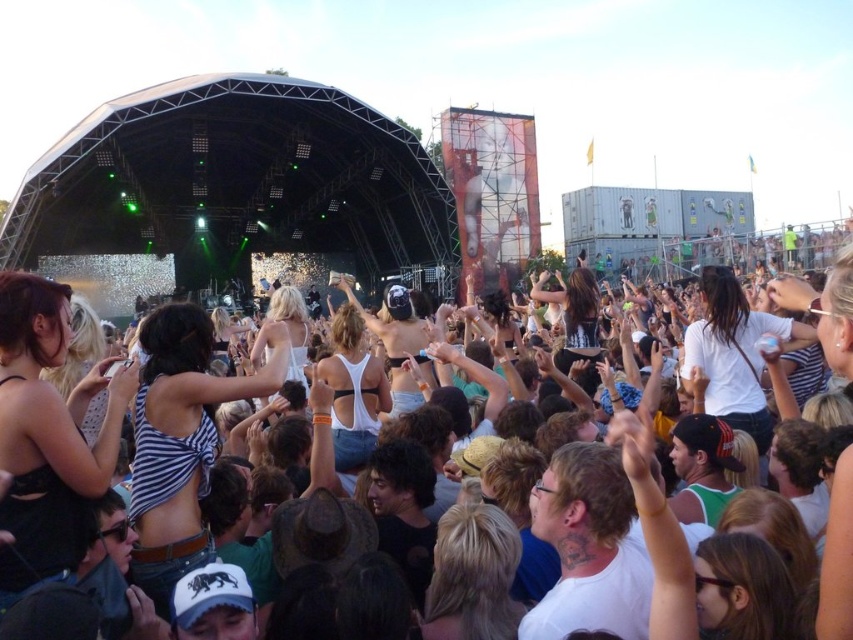
Question: Among these points, which one is nearest to the camera?

Choices:
 (A) (350, 422)
 (B) (821, 292)

Answer: (A)

Question: Does white fabric crowd at center have a smaller size compared to white matte bikini top at center?

Choices:
 (A) no
 (B) yes

Answer: (A)

Question: Does white fabric crowd at center appear on the left side of white matte bikini top at center?

Choices:
 (A) yes
 (B) no

Answer: (B)

Question: Is white fabric crowd at center smaller than white matte bikini top at center?

Choices:
 (A) yes
 (B) no

Answer: (B)

Question: Which point is farther to the camera?

Choices:
 (A) (338, 364)
 (B) (621, 454)

Answer: (A)

Question: Which point is closer to the camera taking this photo?

Choices:
 (A) click(650, 506)
 (B) click(344, 362)

Answer: (A)